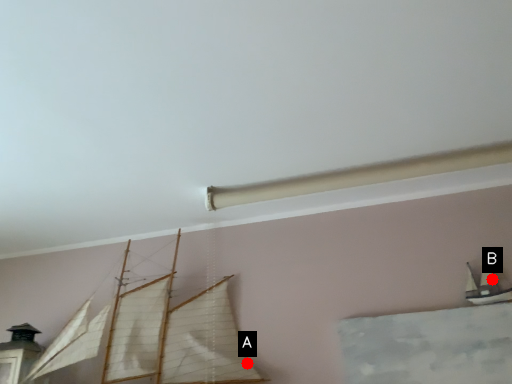
Question: Two points are circled on the image, labeled by A and B beside each circle. Which point is closer to the camera?

Choices:
 (A) A is closer
 (B) B is closer

Answer: (B)